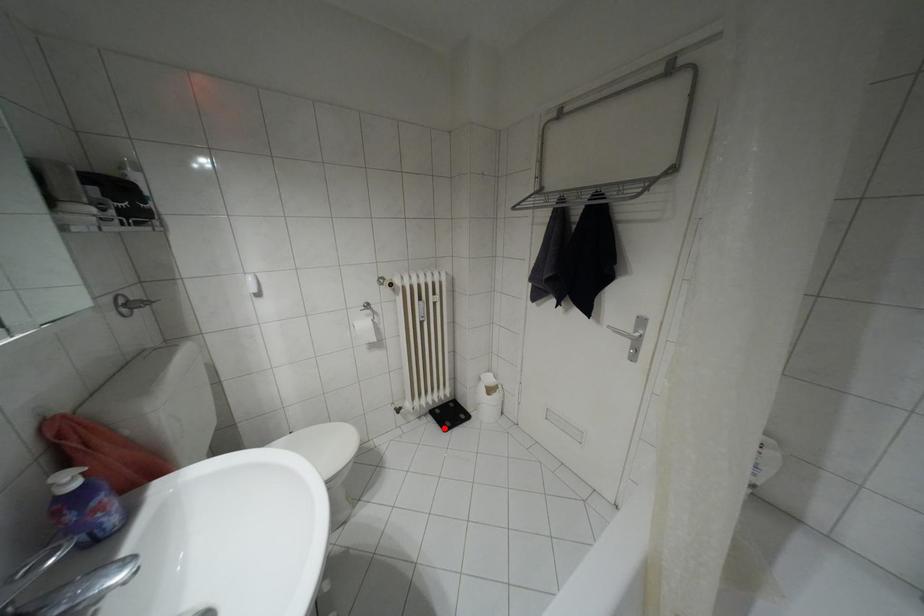
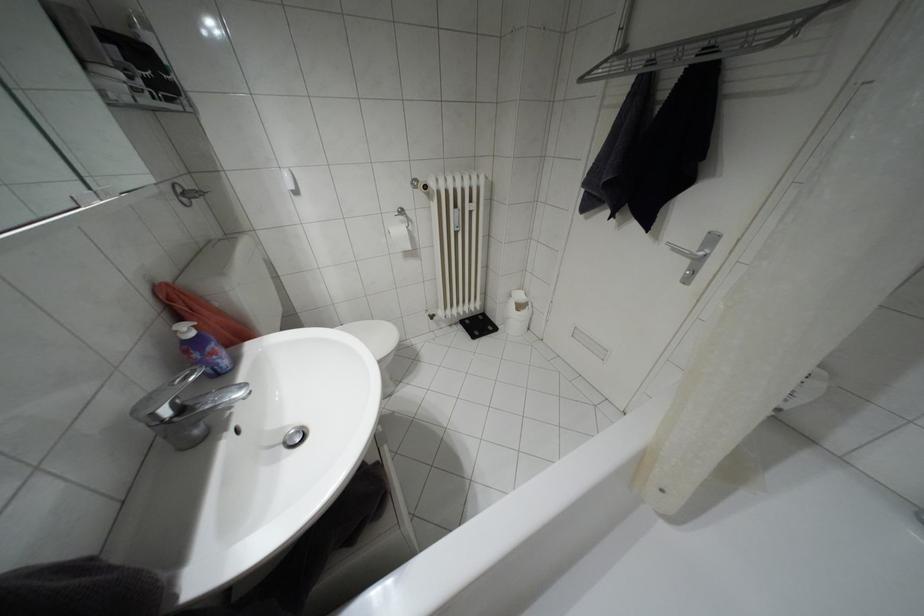
Question: I am providing you with two images of the same scene from different viewpoints. Image1 has a red point marked. In image2, the corresponding 3D location appears at what relative position? Reply with the corresponding letter.

Choices:
 (A) Closer
 (B) Farther

Answer: (A)